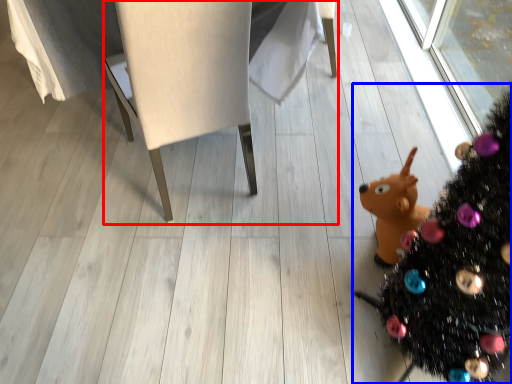
Question: Which object is closer to the camera taking this photo, furniture (highlighted by a red box) or christmas tree (highlighted by a blue box)?

Choices:
 (A) furniture
 (B) christmas tree

Answer: (B)